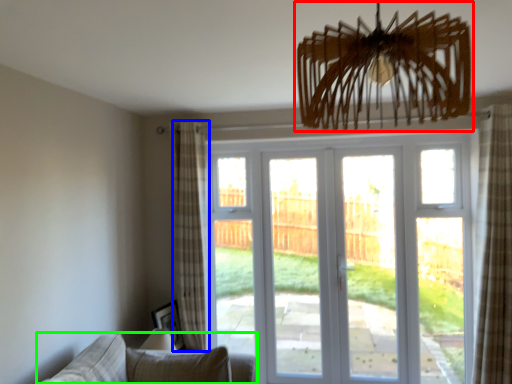
Question: Which is nearer to the chandelier (highlighted by a red box)? curtain (highlighted by a blue box) or studio couch (highlighted by a green box).

Choices:
 (A) curtain
 (B) studio couch

Answer: (B)